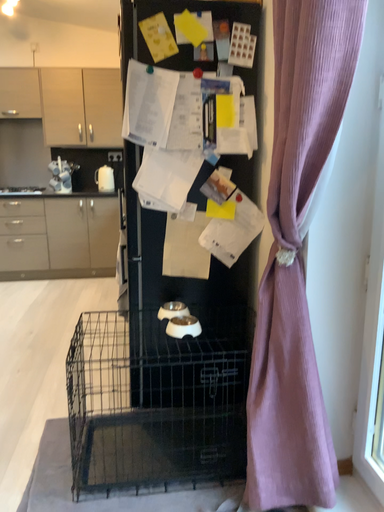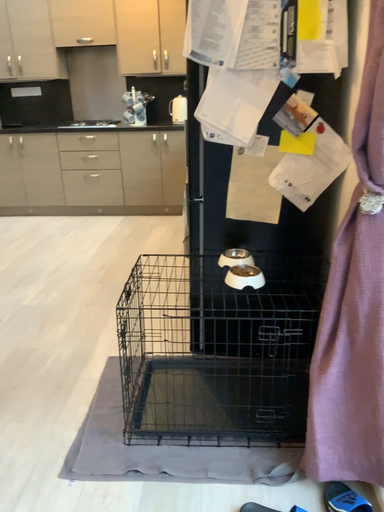
Question: Which way did the camera rotate in the video?

Choices:
 (A) rotated upward
 (B) rotated downward

Answer: (B)